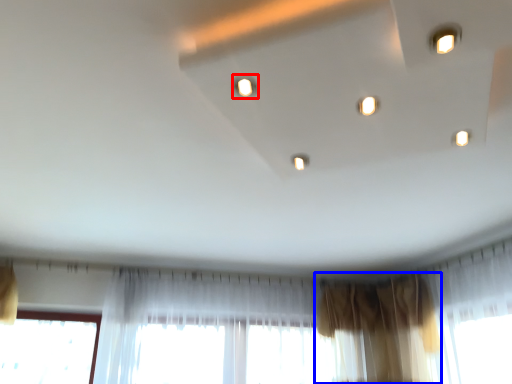
Question: Which object is closer to the camera taking this photo, light (highlighted by a red box) or curtain (highlighted by a blue box)?

Choices:
 (A) light
 (B) curtain

Answer: (A)